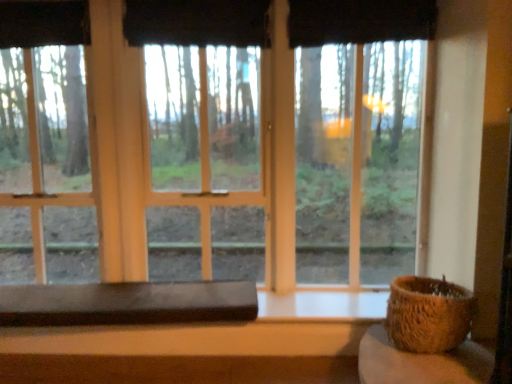
The height and width of the screenshot is (384, 512). Describe the element at coordinates (428, 314) in the screenshot. I see `brown woven basket at right` at that location.

Identify the location of black fabric curtain at upper center, the second curtain from the right. The width and height of the screenshot is (512, 384). (44, 23).

Is brown woven basket at right not near black fabric curtain at upper center, the first curtain viewed from the right?

Yes, brown woven basket at right and black fabric curtain at upper center, the first curtain viewed from the right, are quite far apart.

Is black fabric curtain at upper center, which ranks as the second curtain in left-to-right order, at the back of brown woven basket at right?

That's not correct — brown woven basket at right is not looking away from black fabric curtain at upper center, which ranks as the second curtain in left-to-right order.

Considering the sizes of objects brown woven basket at right and black fabric curtain at upper center, the first curtain viewed from the right, in the image provided, who is thinner, brown woven basket at right or black fabric curtain at upper center, the first curtain viewed from the right,?

Thinner between the two is black fabric curtain at upper center, the first curtain viewed from the right.

How far apart are brown woven basket at right and black fabric curtain at upper center, which ranks as the second curtain in left-to-right order?

brown woven basket at right and black fabric curtain at upper center, which ranks as the second curtain in left-to-right order, are 1.49 meters apart from each other.

Is black fabric curtain at upper center, the second curtain from the right, to the right of brown woven basket at right from the viewer's perspective?

No, black fabric curtain at upper center, the second curtain from the right, is not to the right of brown woven basket at right.

From the image's perspective, is black fabric curtain at upper center, the 1th curtain when ordered from left to right, positioned above or below brown woven basket at right?

From the image's perspective, black fabric curtain at upper center, the 1th curtain when ordered from left to right, appears above brown woven basket at right.

Is black fabric curtain at upper center, the second curtain from the right, positioned in front of brown woven basket at right?

No, it is not.

Considering the sizes of objects black fabric curtain at upper center, the 1th curtain when ordered from left to right, and brown woven basket at right in the image provided, who is shorter, black fabric curtain at upper center, the 1th curtain when ordered from left to right, or brown woven basket at right?

black fabric curtain at upper center, the 1th curtain when ordered from left to right.

Considering the positions of objects rustic woven basket at lower right, arranged as the second table when viewed from the left, and black fabric curtain at upper center, which ranks as the second curtain in left-to-right order, in the image provided, who is in front, rustic woven basket at lower right, arranged as the second table when viewed from the left, or black fabric curtain at upper center, which ranks as the second curtain in left-to-right order,?

rustic woven basket at lower right, arranged as the second table when viewed from the left, is in front.

From a real-world perspective, is rustic woven basket at lower right, placed as the 1th table when sorted from front to back, above or below black fabric curtain at upper center, which ranks as the second curtain in left-to-right order?

rustic woven basket at lower right, placed as the 1th table when sorted from front to back, is situated lower than black fabric curtain at upper center, which ranks as the second curtain in left-to-right order, in the real world.

The width and height of the screenshot is (512, 384). I want to click on table that appears on the right of black fabric curtain at upper center, which ranks as the second curtain in left-to-right order, so click(x=421, y=362).

Is rustic woven basket at lower right, the second table in the back-to-front sequence, bigger or smaller than black fabric curtain at upper center, the first curtain viewed from the right?

rustic woven basket at lower right, the second table in the back-to-front sequence, is bigger than black fabric curtain at upper center, the first curtain viewed from the right.

Would you say black fabric curtain at upper center, which ranks as the second curtain in left-to-right order, is inside or outside white matte window sill at lower center?

black fabric curtain at upper center, which ranks as the second curtain in left-to-right order, is not enclosed by white matte window sill at lower center.

From the image's perspective, does black fabric curtain at upper center, the first curtain viewed from the right, appear lower than white matte window sill at lower center?

Incorrect, from the image's perspective, black fabric curtain at upper center, the first curtain viewed from the right, is higher than white matte window sill at lower center.

Is black fabric curtain at upper center, which ranks as the second curtain in left-to-right order, at the right side of white matte window sill at lower center?

A: Yes.

At what (x,y) coordinates should I click in order to perform the action: click on curtain lying on the right of white matte window sill at lower center. Please return your answer as a coordinate pair (x, y). Looking at the image, I should click on (359, 21).

Is white matte window sill at lower center taller or shorter than transparent glass window at center?

Considering their sizes, white matte window sill at lower center has less height than transparent glass window at center.

Is white matte window sill at lower center looking in the opposite direction of transparent glass window at center?

No, transparent glass window at center is not at the back of white matte window sill at lower center.

Does point (282, 314) lie in front of point (54, 268)?

Yes, point (282, 314) is closer to viewer.

From the image's perspective, is white matte window sill at lower center over transparent glass window at center?

Actually, white matte window sill at lower center appears below transparent glass window at center in the image.

Consider the image. Would you say brown woven basket at right is part of black fabric curtain at upper center, which ranks as the second curtain in left-to-right order,'s contents?

Definitely not — brown woven basket at right is not inside black fabric curtain at upper center, which ranks as the second curtain in left-to-right order.

From the picture: How different are the orientations of black fabric curtain at upper center, the first curtain viewed from the right, and brown woven basket at right in degrees?

The angle between the facing direction of black fabric curtain at upper center, the first curtain viewed from the right, and the facing direction of brown woven basket at right is 0.446 degrees.

Can you confirm if black fabric curtain at upper center, the first curtain viewed from the right, is smaller than brown woven basket at right?

Correct, black fabric curtain at upper center, the first curtain viewed from the right, occupies less space than brown woven basket at right.

Is black fabric curtain at upper center, the first curtain viewed from the right, aimed at brown woven basket at right?

No, black fabric curtain at upper center, the first curtain viewed from the right, is not turned towards brown woven basket at right.

Does black fabric curtain at upper center, the 1th curtain when ordered from left to right, have a lesser width compared to dark brown wood table at lower center, acting as the second table starting from the right?

Correct, the width of black fabric curtain at upper center, the 1th curtain when ordered from left to right, is less than that of dark brown wood table at lower center, acting as the second table starting from the right.

Considering the positions of points (14, 34) and (27, 294), is point (14, 34) farther from camera compared to point (27, 294)?

Yes, point (14, 34) is behind point (27, 294).

From the image's perspective, which one is positioned higher, black fabric curtain at upper center, the second curtain from the right, or dark brown wood table at lower center, the first table positioned from the back?

black fabric curtain at upper center, the second curtain from the right.

Is black fabric curtain at upper center, the 1th curtain when ordered from left to right, positioned with its back to dark brown wood table at lower center, the first table viewed from the left?

That's not correct — black fabric curtain at upper center, the 1th curtain when ordered from left to right, is not looking away from dark brown wood table at lower center, the first table viewed from the left.

The image size is (512, 384). In the image, there is a black fabric curtain at upper center, the first curtain viewed from the right. Find the location of `flowerpot below it (from the image's perspective)`. flowerpot below it (from the image's perspective) is located at coordinates (428, 314).

Locate an element on the screen. This screenshot has height=384, width=512. flowerpot below the black fabric curtain at upper center, the 1th curtain when ordered from left to right (from a real-world perspective) is located at coordinates (428, 314).

In the scene shown: When comparing their distances from dark brown wood table at lower center, the first table viewed from the left, does rustic woven basket at lower right, arranged as the second table when viewed from the left, or brown woven basket at right seem further?

The object further to dark brown wood table at lower center, the first table viewed from the left, is brown woven basket at right.

When comparing their distances from black fabric curtain at upper center, the first curtain viewed from the right, does dark brown wood table at lower center, acting as the second table starting from the right, or white matte window sill at lower center seem further?

The object further to black fabric curtain at upper center, the first curtain viewed from the right, is dark brown wood table at lower center, acting as the second table starting from the right.

Considering their positions, is brown woven basket at right positioned further to rustic woven basket at lower right, which ranks as the 1th table in right-to-left order, than black fabric curtain at upper center, the first curtain viewed from the right?

Among the two, black fabric curtain at upper center, the first curtain viewed from the right, is located further to rustic woven basket at lower right, which ranks as the 1th table in right-to-left order.

When comparing their distances from rustic woven basket at lower right, placed as the 1th table when sorted from front to back, does transparent glass window at center or white matte window sill at lower center seem further?

transparent glass window at center lies further to rustic woven basket at lower right, placed as the 1th table when sorted from front to back, than the other object.

Which object lies further to the anchor point brown woven basket at right, white matte window sill at lower center or dark brown wood table at lower center, acting as the second table starting from the right?

dark brown wood table at lower center, acting as the second table starting from the right, is positioned further to the anchor brown woven basket at right.

Based on the photo, from the image, which object appears to be farther from black fabric curtain at upper center, the first curtain viewed from the right, brown woven basket at right or white matte window sill at lower center?

white matte window sill at lower center lies further to black fabric curtain at upper center, the first curtain viewed from the right, than the other object.

Which object lies nearer to the anchor point black fabric curtain at upper center, the 1th curtain when ordered from left to right, dark brown wood table at lower center, acting as the second table starting from the right, or white matte window sill at lower center?

dark brown wood table at lower center, acting as the second table starting from the right, lies closer to black fabric curtain at upper center, the 1th curtain when ordered from left to right, than the other object.

Looking at the image, which one is located closer to black fabric curtain at upper center, the second curtain from the right, rustic woven basket at lower right, arranged as the second table when viewed from the left, or transparent glass window at center?

rustic woven basket at lower right, arranged as the second table when viewed from the left, lies closer to black fabric curtain at upper center, the second curtain from the right, than the other object.

The image size is (512, 384). Find the location of `window situated between dark brown wood table at lower center, acting as the second table starting from the right, and rustic woven basket at lower right, the second table in the back-to-front sequence, from left to right`. window situated between dark brown wood table at lower center, acting as the second table starting from the right, and rustic woven basket at lower right, the second table in the back-to-front sequence, from left to right is located at coordinates (218, 144).

Identify the location of window sill located between dark brown wood table at lower center, the first table positioned from the back, and brown woven basket at right in the left-right direction. (322, 305).

The width and height of the screenshot is (512, 384). I want to click on window sill located between black fabric curtain at upper center, the 1th curtain when ordered from left to right, and rustic woven basket at lower right, arranged as the second table when viewed from the left, in the left-right direction, so click(x=322, y=305).

The height and width of the screenshot is (384, 512). In order to click on window sill between black fabric curtain at upper center, which ranks as the second curtain in left-to-right order, and rustic woven basket at lower right, the second table in the back-to-front sequence, in the up-down direction in this screenshot , I will do `click(322, 305)`.